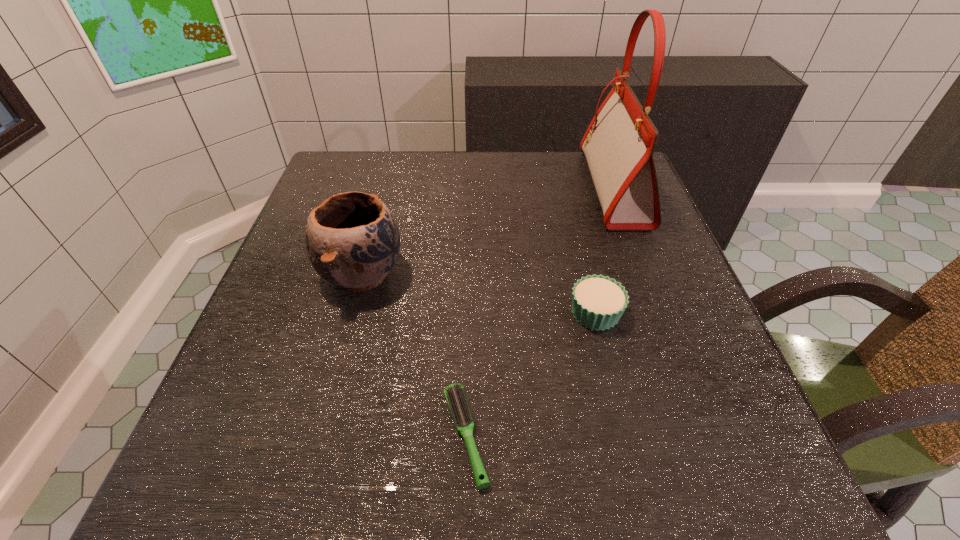
At what (x,y) coordinates should I click in order to perform the action: click on free space located on the right of the second object from right to left. Please return your answer as a coordinate pair (x, y). This screenshot has height=540, width=960. Looking at the image, I should click on (676, 313).

Locate an element on the screen. This screenshot has width=960, height=540. vacant space located on the back of the third object from right to left is located at coordinates (469, 280).

The width and height of the screenshot is (960, 540). What are the coordinates of `object situated at the far edge` in the screenshot? It's located at (619, 143).

Find the location of a particular element. The height and width of the screenshot is (540, 960). object that is at the near edge is located at coordinates (455, 395).

Find the location of a particular element. The height and width of the screenshot is (540, 960). object that is at the left edge is located at coordinates (352, 239).

Identify the location of handbag that is at the right edge. (619, 143).

You are a GUI agent. You are given a task and a screenshot of the screen. Output one action in this format:
    pyautogui.click(x=<x>, y=<y>)
    Task: Click on the cupcake present at the right edge
    The height and width of the screenshot is (540, 960).
    Given the screenshot: What is the action you would take?
    tap(598, 302)

At what (x,y) coordinates should I click in order to perform the action: click on object located in the far right corner section of the desktop. Please return your answer as a coordinate pair (x, y). The image size is (960, 540). Looking at the image, I should click on (619, 143).

In the image, there is a desktop. Where is `vacant space at the far edge`? vacant space at the far edge is located at coordinates (420, 187).

You are a GUI agent. You are given a task and a screenshot of the screen. Output one action in this format:
    pyautogui.click(x=<x>, y=<y>)
    Task: Click on the vacant space at the near edge
    This screenshot has width=960, height=540.
    Given the screenshot: What is the action you would take?
    pyautogui.click(x=392, y=474)